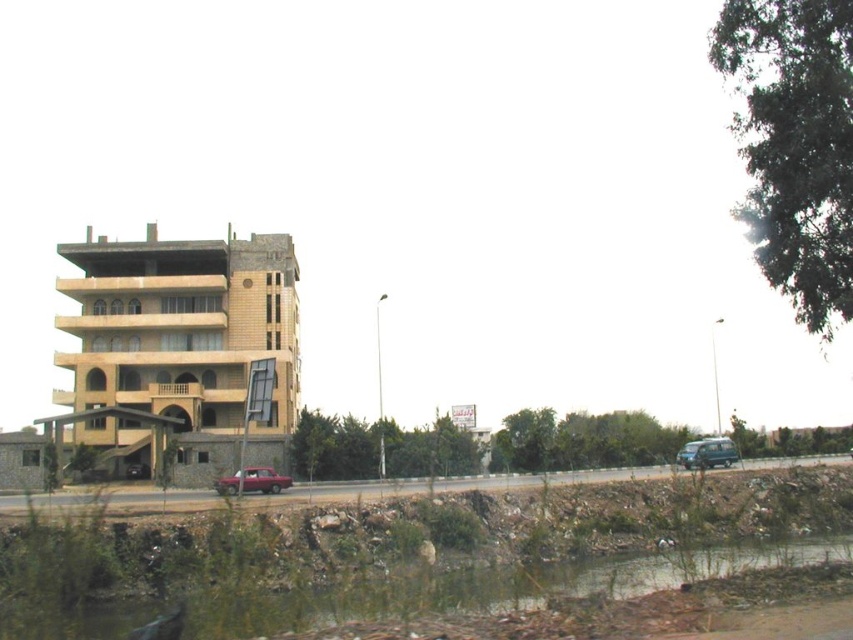
Question: Which of the following is the closest to the observer?

Choices:
 (A) brown dirt at lower left
 (B) matte red car at center
 (C) metallic blue van at lower right

Answer: (A)

Question: Among these objects, which one is nearest to the camera?

Choices:
 (A) metallic blue van at lower right
 (B) brown dirt at lower left

Answer: (B)

Question: Does brown dirt at lower left have a greater width compared to metallic blue van at lower right?

Choices:
 (A) yes
 (B) no

Answer: (A)

Question: Which point appears closest to the camera in this image?

Choices:
 (A) (213, 484)
 (B) (403, 577)

Answer: (B)

Question: Does metallic blue van at lower right lie behind matte red car at center?

Choices:
 (A) yes
 (B) no

Answer: (A)

Question: Is brown dirt at lower left wider than matte red car at center?

Choices:
 (A) yes
 (B) no

Answer: (A)